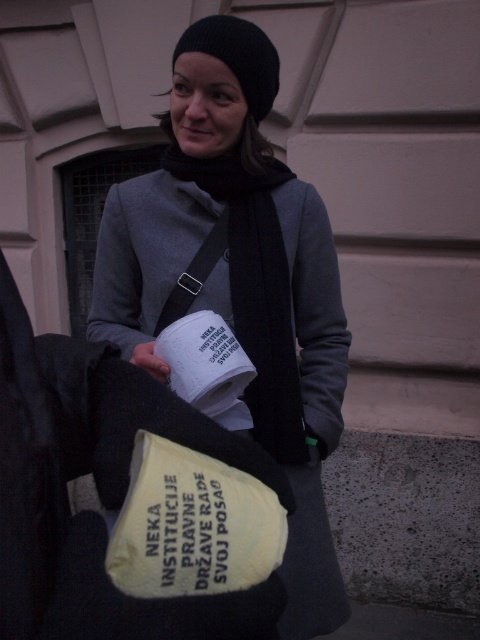
Based on the scene description, which object is taller when viewed from the front? The matte gray sweater at center or the black knit hat at upper center?

The matte gray sweater at center is taller than the black knit hat at upper center.

You are a photographer taking a picture of the matte gray sweater at center and the white matte paper cup at center. Which object should you focus on first if you want to capture both in sharp focus, considering their heights?

The matte gray sweater at center has a greater height compared to the white matte paper cup at center, so you should focus on the taller matte gray sweater at center first to ensure both are in sharp focus.

You are a photographer trying to capture the black knit hat at upper center and the white matte paper cup at center in your shot. Based on their positions, which object should you adjust your camera to focus on first if you want to include both in the frame?

The white matte paper cup at center is to the left of the black knit hat at upper center, so you should focus on the black knit hat at upper center first to ensure both objects are in the frame.